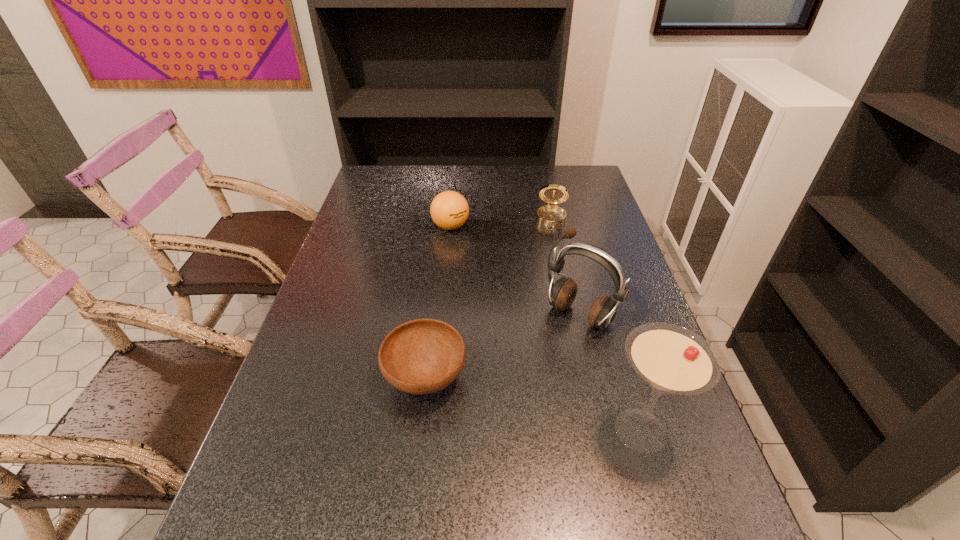
The width and height of the screenshot is (960, 540). Identify the location of object situated at the near right corner. (671, 359).

Image resolution: width=960 pixels, height=540 pixels. Identify the location of vacant region at the far edge of the desktop. (433, 192).

In the image, there is a desktop. At what (x,y) coordinates should I click in order to perform the action: click on vacant space at the left edge. Please return your answer as a coordinate pair (x, y). Looking at the image, I should click on (340, 251).

You are a GUI agent. You are given a task and a screenshot of the screen. Output one action in this format:
    pyautogui.click(x=<x>, y=<y>)
    Task: Click on the vacant region at the right edge of the desktop
    The image size is (960, 540).
    Given the screenshot: What is the action you would take?
    pyautogui.click(x=634, y=297)

You are a GUI agent. You are given a task and a screenshot of the screen. Output one action in this format:
    pyautogui.click(x=<x>, y=<y>)
    Task: Click on the vacant region at the far left corner of the desktop
    
    Given the screenshot: What is the action you would take?
    pyautogui.click(x=401, y=187)

You are a GUI agent. You are given a task and a screenshot of the screen. Output one action in this format:
    pyautogui.click(x=<x>, y=<y>)
    Task: Click on the vacant region at the far right corner of the desktop
    The image size is (960, 540).
    Given the screenshot: What is the action you would take?
    pyautogui.click(x=579, y=167)

I want to click on vacant space at the near right corner of the desktop, so click(703, 481).

The image size is (960, 540). I want to click on empty location between the martini and the bowl, so click(533, 404).

You are a GUI agent. You are given a task and a screenshot of the screen. Output one action in this format:
    pyautogui.click(x=<x>, y=<y>)
    Task: Click on the vacant region between the compass and the ping-pong ball
    The height and width of the screenshot is (540, 960).
    Given the screenshot: What is the action you would take?
    pyautogui.click(x=501, y=223)

At what (x,y) coordinates should I click in order to perform the action: click on free space between the third farthest object and the compass. Please return your answer as a coordinate pair (x, y). This screenshot has height=540, width=960. Looking at the image, I should click on (566, 268).